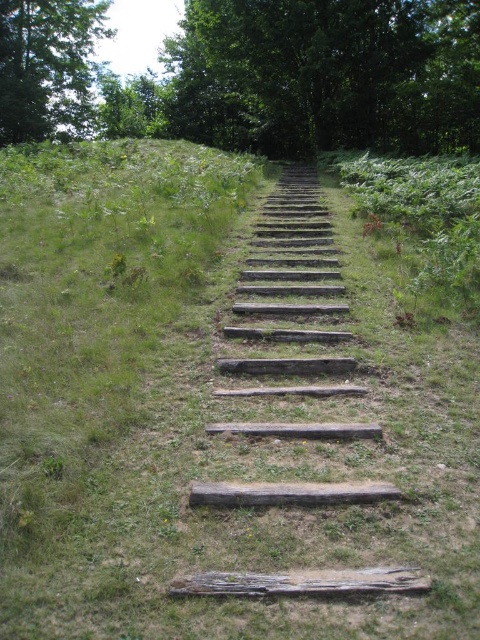
You are standing at the bottom of the weathered wood stairs at center and want to reach the green leafy tree at upper left. Which direction should you walk to get closer to the tree?

The green leafy tree at upper left is located above the weathered wood stairs at center, so you should walk upwards along the weathered wood stairs at center to get closer to the green leafy tree at upper left.